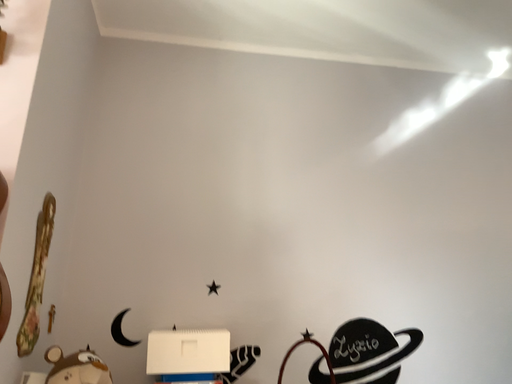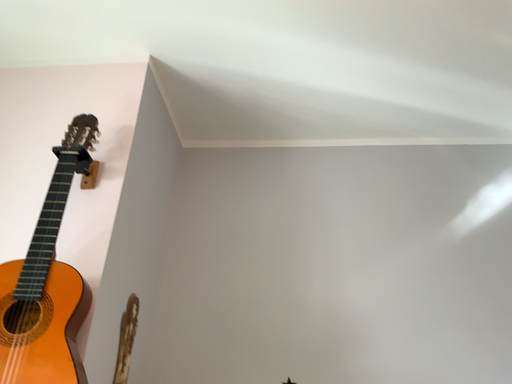
Question: Which way did the camera rotate in the video?

Choices:
 (A) rotated right
 (B) rotated left

Answer: (B)